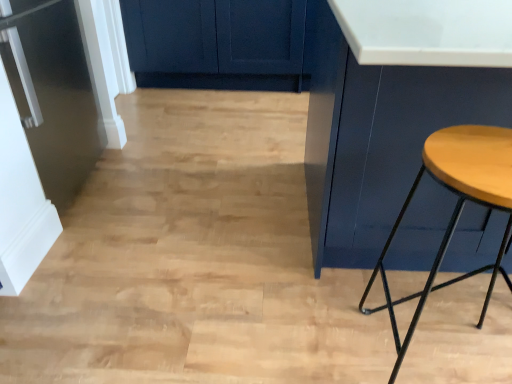
Question: Considering the relative sizes of matte blue cabinet at right and wooden stool at right in the image provided, is matte blue cabinet at right thinner than wooden stool at right?

Choices:
 (A) yes
 (B) no

Answer: (B)

Question: Can you see matte blue cabinet at right touching wooden stool at right?

Choices:
 (A) yes
 (B) no

Answer: (B)

Question: Is matte blue cabinet at right to the left of wooden stool at right from the viewer's perspective?

Choices:
 (A) no
 (B) yes

Answer: (A)

Question: From the image's perspective, is matte blue cabinet at right located beneath wooden stool at right?

Choices:
 (A) yes
 (B) no

Answer: (B)

Question: Considering the relative positions of matte blue cabinet at right and wooden stool at right in the image provided, is matte blue cabinet at right to the right of wooden stool at right from the viewer's perspective?

Choices:
 (A) yes
 (B) no

Answer: (A)

Question: From the image's perspective, is wooden stool at right located above or below satin black refrigerator at left?

Choices:
 (A) above
 (B) below

Answer: (B)

Question: Considering their positions, is wooden stool at right located in front of or behind satin black refrigerator at left?

Choices:
 (A) behind
 (B) front

Answer: (B)

Question: From their relative heights in the image, would you say wooden stool at right is taller or shorter than satin black refrigerator at left?

Choices:
 (A) tall
 (B) short

Answer: (B)

Question: Based on their positions, is wooden stool at right located to the left or right of satin black refrigerator at left?

Choices:
 (A) left
 (B) right

Answer: (B)

Question: Would you say matte blue cabinet at right is to the left or to the right of wooden stool at right in the picture?

Choices:
 (A) right
 (B) left

Answer: (A)

Question: In terms of width, does matte blue cabinet at right look wider or thinner when compared to wooden stool at right?

Choices:
 (A) wide
 (B) thin

Answer: (A)

Question: Would you say matte blue cabinet at right is inside or outside wooden stool at right?

Choices:
 (A) outside
 (B) inside

Answer: (A)

Question: In terms of height, does matte blue cabinet at right look taller or shorter compared to wooden stool at right?

Choices:
 (A) tall
 (B) short

Answer: (A)

Question: From a real-world perspective, is matte blue cabinet at right positioned above or below satin black refrigerator at left?

Choices:
 (A) below
 (B) above

Answer: (B)

Question: Considering the positions of matte blue cabinet at right and satin black refrigerator at left in the image, is matte blue cabinet at right bigger or smaller than satin black refrigerator at left?

Choices:
 (A) small
 (B) big

Answer: (B)